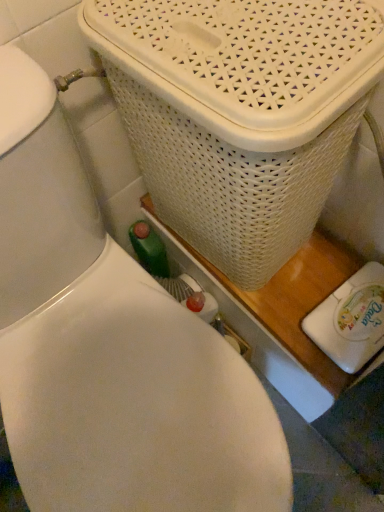
Locate an element on the screen. The width and height of the screenshot is (384, 512). free space that is to the left of white plastic toilet brush at lower right is located at coordinates 283,311.